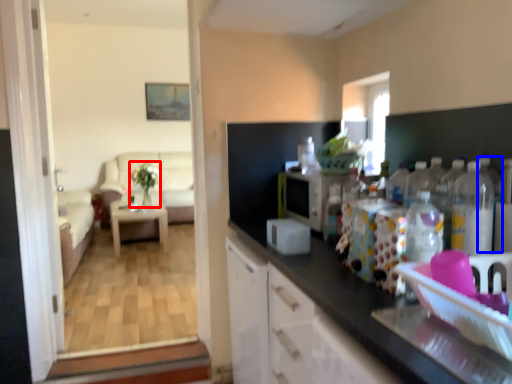
Question: Which object is closer to the camera taking this photo, plant (highlighted by a red box) or bottle (highlighted by a blue box)?

Choices:
 (A) plant
 (B) bottle

Answer: (B)